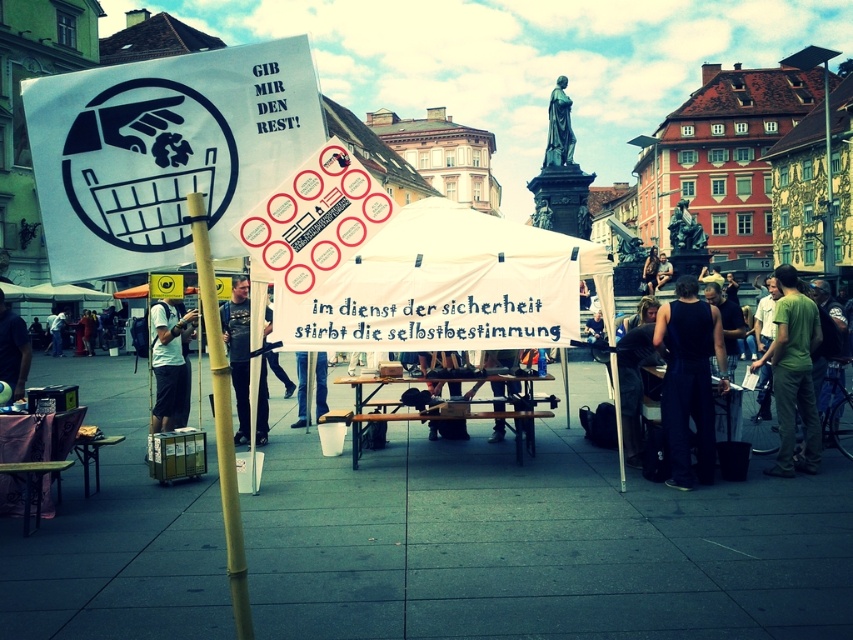
Is green cotton shirt at right thinner than white cotton shirt at center?

No, green cotton shirt at right is not thinner than white cotton shirt at center.

Who is taller, green cotton shirt at right or white cotton shirt at center?

green cotton shirt at right is taller.

I want to click on green cotton shirt at right, so click(x=793, y=374).

Which is behind, point (693, 298) or point (543, 164)?

Positioned behind is point (543, 164).

Measure the distance between point [672,403] and camera.

The distance of point [672,403] from camera is 28.46 meters.

Is point (672, 349) closer to camera compared to point (560, 131)?

Yes, it is in front of point (560, 131).

Locate an element on the screen. black fabric pants at center is located at coordinates (689, 380).

Can you confirm if gray concrete pavement at center is wider than green marble statue at upper center?

Yes.

Who is taller, gray concrete pavement at center or green marble statue at upper center?

With more height is gray concrete pavement at center.

Does point (26, 618) come in front of point (549, 99)?

Yes, it is.

Identify the location of gray concrete pavement at center. The image size is (853, 640). (537, 544).